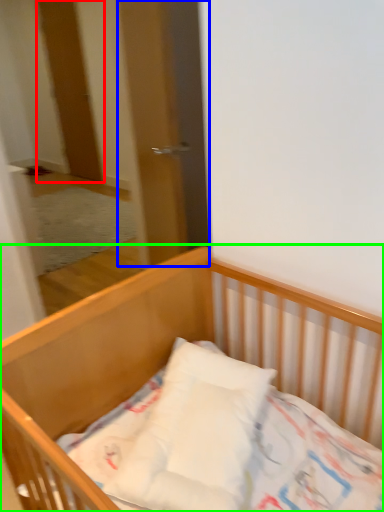
Question: Which object is positioned closest to door (highlighted by a red box)? Select from screen door (highlighted by a blue box) and bed (highlighted by a green box).

Choices:
 (A) screen door
 (B) bed

Answer: (A)